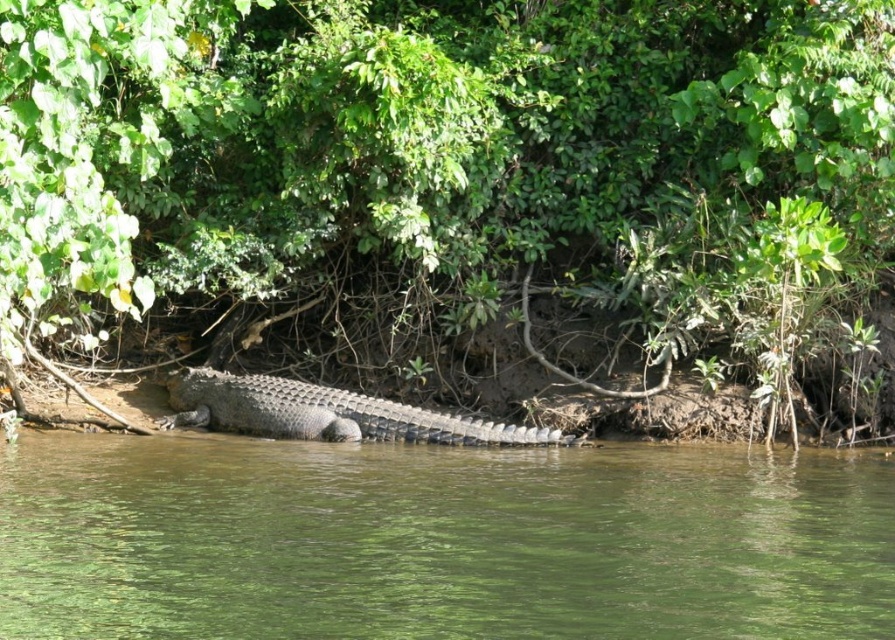
In the scene shown: Who is taller, green leafy tree at center or greenish-brown water at center?

green leafy tree at center

Between green leafy tree at center and greenish-brown water at center, which one has less height?

greenish-brown water at center is shorter.

Consider the image. Who is more distant from viewer, (91, 132) or (16, 566)?

Point (91, 132)

Where is `green leafy tree at center`? The width and height of the screenshot is (895, 640). green leafy tree at center is located at coordinates (449, 180).

Which is more to the left, green leafy tree at center or sandy brown scaly crocodile at center?

Positioned to the left is sandy brown scaly crocodile at center.

Is point (504, 257) more distant than point (304, 429)?

Yes.

Where is `green leafy tree at center`? The image size is (895, 640). green leafy tree at center is located at coordinates (449, 180).

Which is in front, point (88, 544) or point (379, 436)?

Point (88, 544)

Is greenish-brown water at center bigger than sandy brown scaly crocodile at center?

Yes.

Is point (862, 541) closer to camera compared to point (354, 440)?

That is True.

Find the location of a particular element. The image size is (895, 640). greenish-brown water at center is located at coordinates (439, 540).